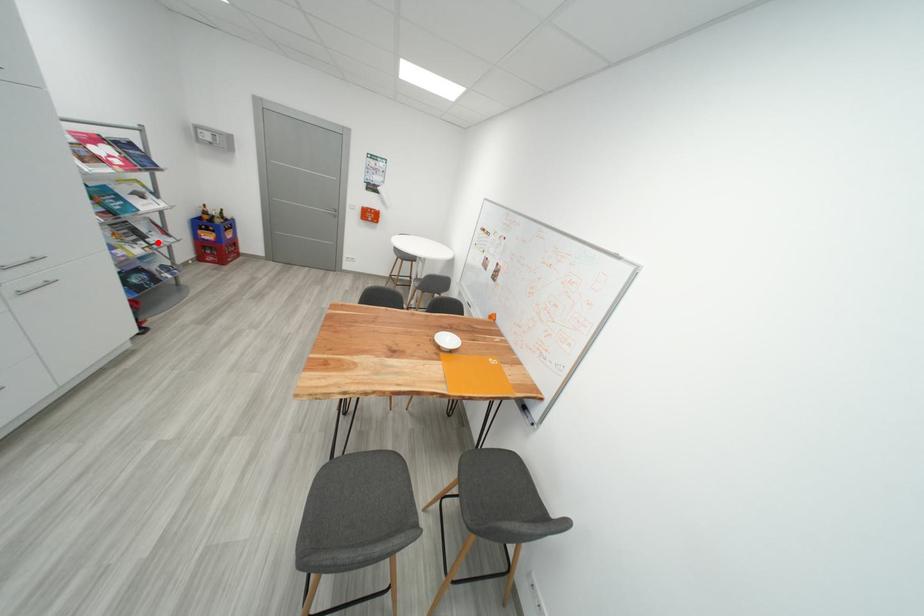
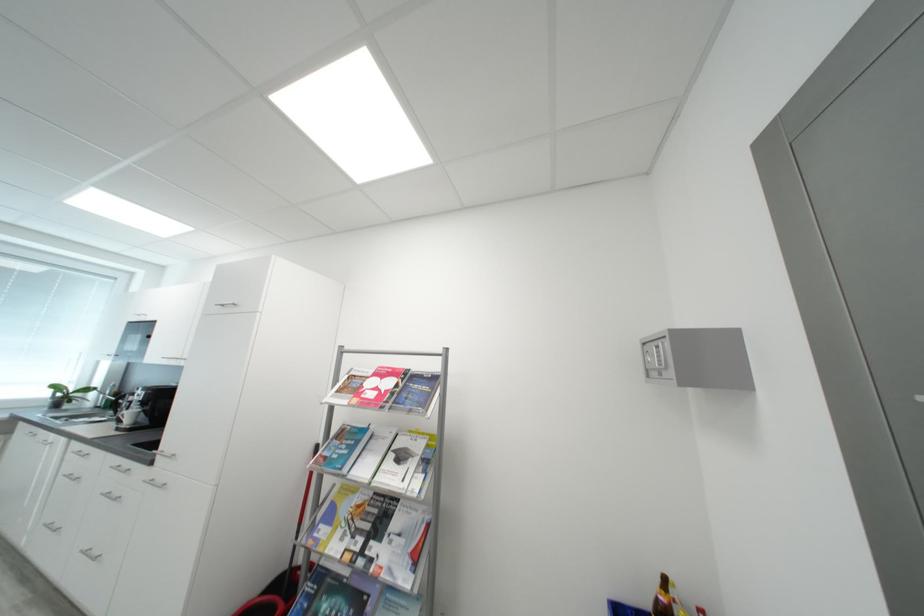
Question: I am providing you with two images of the same scene from different viewpoints. A red point is marked on the first image. At the location where the point appears in image 1, is it still visible in image 2?

Choices:
 (A) Yes
 (B) No

Answer: (A)